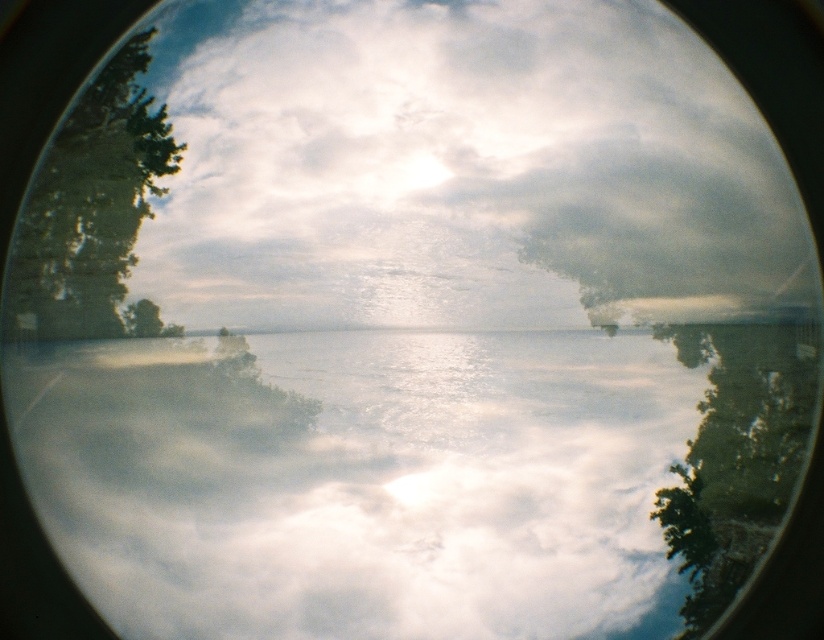
Question: Considering the real-world distances, which object is closest to the green leafy tree at left?

Choices:
 (A) translucent glass water at center
 (B) cloudy sky at upper center

Answer: (B)

Question: Can you confirm if cloudy sky at upper center is wider than green leafy tree at left?

Choices:
 (A) yes
 (B) no

Answer: (A)

Question: Which object appears closest to the camera in this image?

Choices:
 (A) cloudy sky at upper center
 (B) green leafy tree at left

Answer: (B)

Question: Is cloudy sky at upper center further to the viewer compared to green leafy tree at left?

Choices:
 (A) yes
 (B) no

Answer: (A)

Question: Which point is closer to the camera?

Choices:
 (A) (502, 436)
 (B) (64, 285)

Answer: (B)

Question: Does translucent glass water at center appear under green leafy tree at left?

Choices:
 (A) no
 (B) yes

Answer: (B)